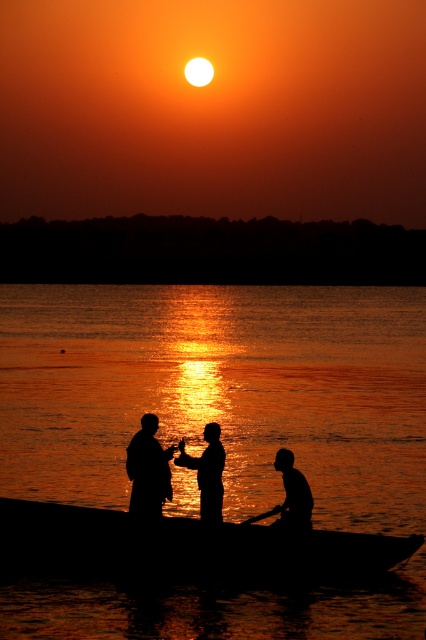
You are a photographer trying to capture the sunset reflection on the water. You notice the silhouette wooden pole at center and the wooden smooth paddle at lower center. Which object is closer to the camera based on their positions?

The silhouette wooden pole at center is above the wooden smooth paddle at lower center, so it is closer to the camera.

You are an observer standing on the shore looking at the sunset scene. You notice a silhouette wooden pole at center and a wooden smooth paddle at lower center. Which object is wider?

The silhouette wooden pole at center is wider than the wooden smooth paddle at lower center.

You are standing at the point with coordinates of 0.5, 0.5 in this image. You want to walk to the silky water at center. Which direction should you move? Please answer with North, South, East, or West.

The silky water at center is located at point (x=219, y=392). Your current position is at (x=213, y=320). Since the x coordinate of the silky water at center is higher than yours, you should move East to reach it.